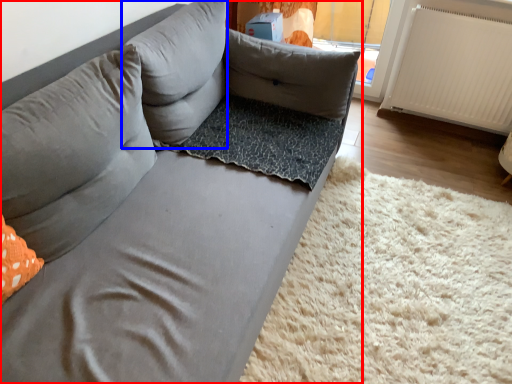
Question: Which object appears closest to the camera in this image, studio couch (highlighted by a red box) or pillow (highlighted by a blue box)?

Choices:
 (A) studio couch
 (B) pillow

Answer: (A)